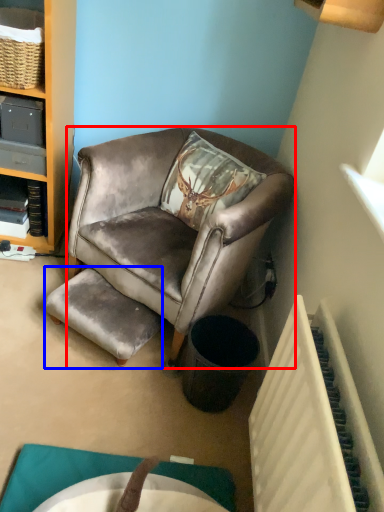
Question: Which point is further to the camera, chair (highlighted by a red box) or stool (highlighted by a blue box)?

Choices:
 (A) chair
 (B) stool

Answer: (B)